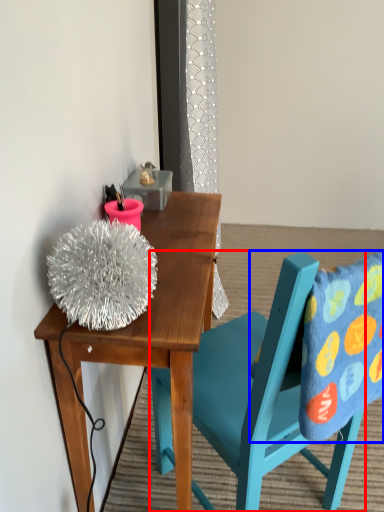
Question: Which object appears closest to the camera in this image, chair (highlighted by a red box) or pillow (highlighted by a blue box)?

Choices:
 (A) chair
 (B) pillow

Answer: (A)